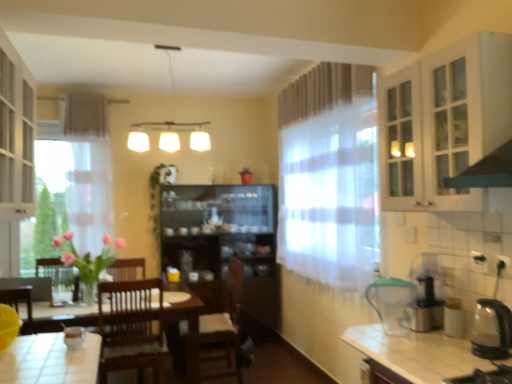
In order to face wooden cabinet at lower right, placed as the 1th cabinetry when sorted from bottom to top, should I rotate leftwards or rightwards?

It's best to rotate right around 16.374 degrees.

In the scene shown: In order to face translucent fabric curtain at center, should I rotate leftwards or rightwards?

You should look right and rotate roughly 10.922 degrees.

The width and height of the screenshot is (512, 384). What do you see at coordinates (329, 175) in the screenshot?
I see `translucent fabric curtain at center` at bounding box center [329, 175].

This screenshot has width=512, height=384. In order to click on white glass cabinet at left, the second cabinetry when ordered from top to bottom in this screenshot , I will do `click(16, 134)`.

What is the approximate width of white glossy table at lower left?

white glossy table at lower left is 52.13 centimeters wide.

This screenshot has height=384, width=512. What do you see at coordinates (50, 360) in the screenshot?
I see `white glossy table at lower left` at bounding box center [50, 360].

Identify the location of white glass cabinet at upper right, which is the first cabinetry in top-to-bottom order. This screenshot has height=384, width=512. (443, 122).

Locate an element on the screen. The image size is (512, 384). wooden cabinet at lower right, which is the third cabinetry in top-to-bottom order is located at coordinates (379, 373).

What's the angular difference between white glass cabinet at upper right, which ranks as the third cabinetry in bottom-to-top order, and translucent fabric curtain at center's facing directions?

They differ by 1.9 degrees in their facing directions.

Would you say translucent fabric curtain at center is part of white glass cabinet at upper right, which is the first cabinetry in top-to-bottom order,'s contents?

No, translucent fabric curtain at center is not surrounded by white glass cabinet at upper right, which is the first cabinetry in top-to-bottom order.

What are the coordinates of `window below the white glass cabinet at upper right, which ranks as the third cabinetry in bottom-to-top order (from a real-world perspective)` in the screenshot? It's located at (329, 175).

Considering the relative sizes of white glass cabinet at upper right, which is the first cabinetry in top-to-bottom order, and translucent fabric curtain at center in the image provided, is white glass cabinet at upper right, which is the first cabinetry in top-to-bottom order, smaller than translucent fabric curtain at center?

Indeed, white glass cabinet at upper right, which is the first cabinetry in top-to-bottom order, has a smaller size compared to translucent fabric curtain at center.

Between point (71, 362) and point (409, 131), which one is positioned behind?

The point (409, 131) is more distant.

Can you confirm if white glossy table at lower left is bigger than clear glass cabinet at upper right?

Yes, white glossy table at lower left is bigger than clear glass cabinet at upper right.

Is white glossy table at lower left oriented towards clear glass cabinet at upper right?

No, white glossy table at lower left does not turn towards clear glass cabinet at upper right.

Considering the relative sizes of white matte light fixture at upper center and clear glass cabinet at upper right in the image provided, is white matte light fixture at upper center thinner than clear glass cabinet at upper right?

In fact, white matte light fixture at upper center might be wider than clear glass cabinet at upper right.

From the image's perspective, is white matte light fixture at upper center under clear glass cabinet at upper right?

Incorrect, from the image's perspective, white matte light fixture at upper center is higher than clear glass cabinet at upper right.

Is white matte light fixture at upper center positioned with its back to clear glass cabinet at upper right?

That's not correct — white matte light fixture at upper center is not looking away from clear glass cabinet at upper right.

Is brown wooden chair at center turned away from transparent glass kettle at right, arranged as the second appliance when viewed from the back?

No, transparent glass kettle at right, arranged as the second appliance when viewed from the back, is not at the back of brown wooden chair at center.

Considering the relative sizes of brown wooden chair at center and transparent glass kettle at right, which is counted as the first appliance, starting from the front, in the image provided, is brown wooden chair at center wider than transparent glass kettle at right, which is counted as the first appliance, starting from the front,?

Yes.

Identify the location of the 2nd appliance to the right of the brown wooden chair at center, counting from the anchor's position. The width and height of the screenshot is (512, 384). (490, 330).

From the image's perspective, is black plastic coffee machine at right located beneath clear glass cabinet at upper right?

Yes.

Does black plastic coffee machine at right turn towards clear glass cabinet at upper right?

No, black plastic coffee machine at right is not facing towards clear glass cabinet at upper right.

Which object is positioned more to the right, black plastic coffee machine at right or clear glass cabinet at upper right?

Positioned to the right is black plastic coffee machine at right.

Which is behind, black plastic coffee machine at right or clear glass cabinet at upper right?

clear glass cabinet at upper right.

Are green rubber hose at lower right, the 1th appliance positioned from the left, and transparent glass kettle at right, placed as the first appliance when sorted from right to left, far apart?

No, green rubber hose at lower right, the 1th appliance positioned from the left, is in close proximity to transparent glass kettle at right, placed as the first appliance when sorted from right to left.

Does green rubber hose at lower right, placed as the 1th appliance when sorted from back to front, contain transparent glass kettle at right, the second appliance when ordered from left to right?

No, transparent glass kettle at right, the second appliance when ordered from left to right, is not surrounded by green rubber hose at lower right, placed as the 1th appliance when sorted from back to front.

Which of these two, green rubber hose at lower right, marked as the second appliance in a right-to-left arrangement, or transparent glass kettle at right, placed as the first appliance when sorted from right to left, is bigger?

green rubber hose at lower right, marked as the second appliance in a right-to-left arrangement.

Does green rubber hose at lower right, marked as the second appliance in a right-to-left arrangement, have a lesser width compared to transparent glass kettle at right, the second appliance when ordered from left to right?

Incorrect, the width of green rubber hose at lower right, marked as the second appliance in a right-to-left arrangement, is not less than that of transparent glass kettle at right, the second appliance when ordered from left to right.

Between translucent fabric curtain at center and black plastic coffee machine at right, which one appears on the right side from the viewer's perspective?

Positioned to the right is black plastic coffee machine at right.

Which of these two, translucent fabric curtain at center or black plastic coffee machine at right, stands shorter?

black plastic coffee machine at right is shorter.

Is black plastic coffee machine at right at the back of translucent fabric curtain at center?

That's not correct — translucent fabric curtain at center is not looking away from black plastic coffee machine at right.

You are a GUI agent. You are given a task and a screenshot of the screen. Output one action in this format:
    pyautogui.click(x=<x>, y=<y>)
    Task: Click on the 2nd cabinetry above the translucent fabric curtain at center (from the image's perspective)
    Image resolution: width=512 pixels, height=384 pixels.
    Given the screenshot: What is the action you would take?
    pyautogui.click(x=443, y=122)

This screenshot has width=512, height=384. I want to click on glass door located behind the white glossy table at lower left, so click(400, 140).

When comparing their distances from white glossy table at lower left, does wooden cabinet at lower right, which is the third cabinetry in top-to-bottom order, or white glass cabinet at upper right, which ranks as the third cabinetry in bottom-to-top order, seem further?

white glass cabinet at upper right, which ranks as the third cabinetry in bottom-to-top order.

Looking at the image, which one is located closer to white glass cabinet at left, the 2th cabinetry ordered from the bottom, translucent fabric curtain at center or clear glass cabinet at upper right?

clear glass cabinet at upper right.

When comparing their distances from green rubber hose at lower right, placed as the 1th appliance when sorted from back to front, does white glass cabinet at left, arranged as the first cabinetry when viewed from the left, or transparent glass kettle at right, arranged as the second appliance when viewed from the back, seem closer?

Based on the image, transparent glass kettle at right, arranged as the second appliance when viewed from the back, appears to be nearer to green rubber hose at lower right, placed as the 1th appliance when sorted from back to front.

Considering their positions, is brown wooden chair at center positioned closer to white glossy table at lower left than black plastic coffee machine at right?

brown wooden chair at center is positioned closer to the anchor white glossy table at lower left.

Based on their spatial positions, is transparent glass kettle at right, which is counted as the first appliance, starting from the front, or black plastic coffee machine at right further from white glossy table at lower left?

transparent glass kettle at right, which is counted as the first appliance, starting from the front.

Considering their positions, is white glossy table at lower left positioned closer to translucent fabric curtain at center than black plastic coffee machine at right?

Among the two, black plastic coffee machine at right is located nearer to translucent fabric curtain at center.

From the image, which object appears to be nearer to white glass cabinet at upper right, the 1th cabinetry viewed from the right, green rubber hose at lower right, the 1th appliance positioned from the left, or clear glass cabinet at upper right?

Based on the image, clear glass cabinet at upper right appears to be nearer to white glass cabinet at upper right, the 1th cabinetry viewed from the right.

Based on their spatial positions, is translucent fabric curtain at center or white glass cabinet at left, the 2th cabinetry ordered from the bottom, closer to clear glass cabinet at upper right?

The object closer to clear glass cabinet at upper right is translucent fabric curtain at center.

You are a GUI agent. You are given a task and a screenshot of the screen. Output one action in this format:
    pyautogui.click(x=<x>, y=<y>)
    Task: Click on the window between white matte light fixture at upper center and black plastic coffee machine at right
    
    Given the screenshot: What is the action you would take?
    click(x=329, y=175)

Locate an element on the screen. coffee machine between clear glass cabinet at upper right and wooden cabinet at lower right, placed as the 2th cabinetry when sorted from right to left, in the vertical direction is located at coordinates (425, 299).

What are the coordinates of `coffee machine between clear glass cabinet at upper right and green rubber hose at lower right, placed as the 1th appliance when sorted from back to front, vertically` in the screenshot? It's located at (425, 299).

Find the location of a particular element. This screenshot has width=512, height=384. glass door between white glass cabinet at left, the third cabinetry positioned from the right, and black plastic coffee machine at right is located at coordinates (400, 140).